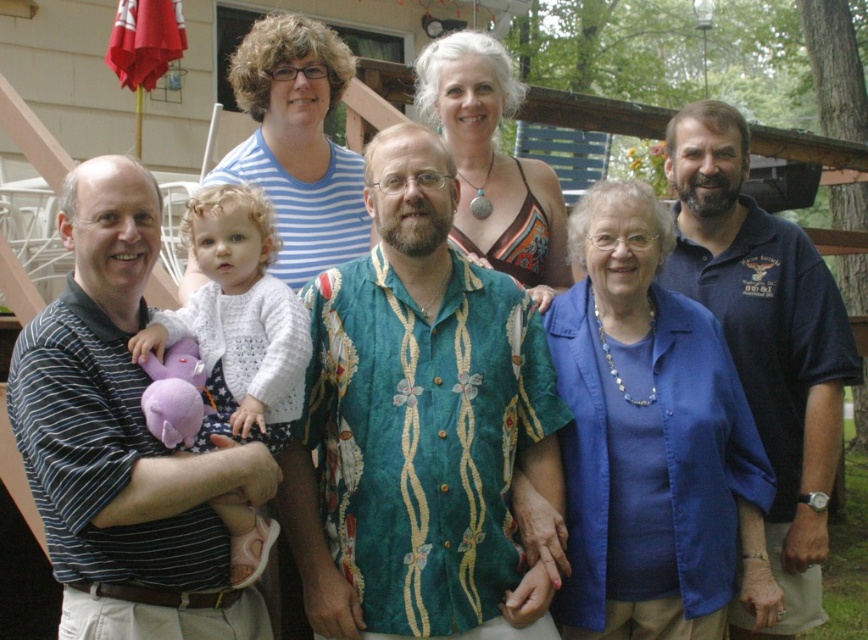
Is striped shirt at left to the right of white knitted sweater at center from the viewer's perspective?

No, striped shirt at left is not to the right of white knitted sweater at center.

Is point (70, 316) farther from viewer compared to point (217, 428)?

No.

This screenshot has width=868, height=640. What are the coordinates of `striped shirt at left` in the screenshot? It's located at coord(123,440).

Is green floral shirt at center thinner than striped shirt at left?

No, green floral shirt at center is not thinner than striped shirt at left.

Between point (391, 131) and point (130, 547), which one is positioned behind?

The point (391, 131) is more distant.

Locate an element on the screen. green floral shirt at center is located at coordinates (419, 426).

From the picture: Who is shorter, dark blue polo shirt at right or white knitted sweater at center?

white knitted sweater at center is shorter.

Who is higher up, dark blue polo shirt at right or white knitted sweater at center?

white knitted sweater at center

At what (x,y) coordinates should I click in order to perform the action: click on dark blue polo shirt at right. Please return your answer as a coordinate pair (x, y). The image size is (868, 640). Looking at the image, I should click on (765, 340).